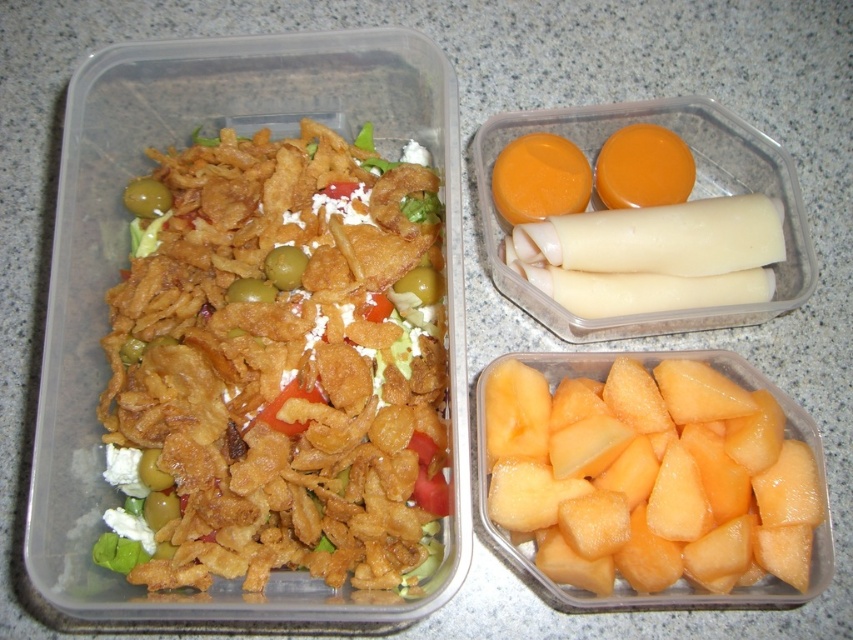
You are a delivery person who needs to place a package at the exact center of the countertop. The golden crispy chips at center are currently occupying the center. Can you move them to the left to make space?

The golden crispy chips at center are already located at the center of the countertop, so moving them to the left would shift them away from the center. Therefore, you cannot place the package at the exact center while keeping the chips there. You would need to move them either left or right to create space.